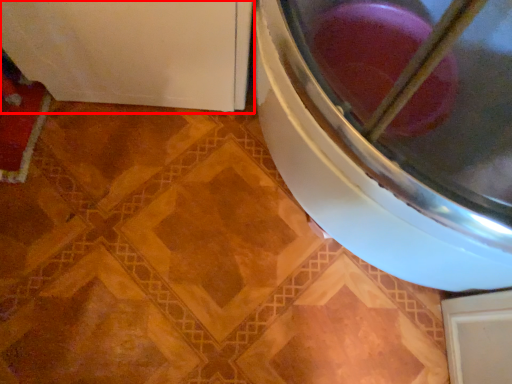
Question: From the image, what is the correct spatial relationship of appliance (annotated by the red box) in relation to washing machine?

Choices:
 (A) left
 (B) right

Answer: (A)